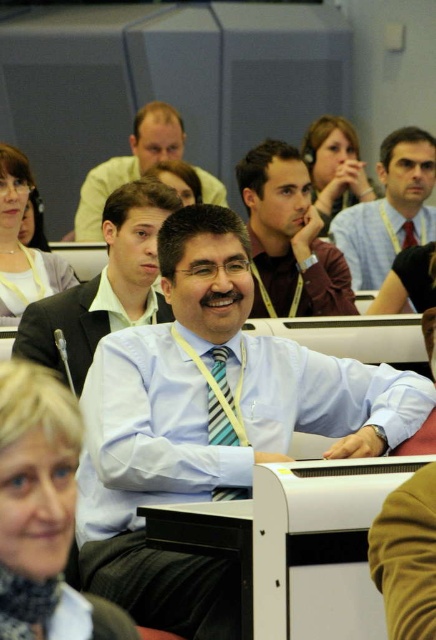
In the conference room scene, there is a man wearing a striped fabric tie at center and a lanyard around his neck. What is located at the point with coordinates (x=222, y=403)?

The point at (x=222, y=403) is on the striped fabric tie at center.

You are standing in the conference room and want to place a small plant exactly at point (320, 240). The plant requires a space of 1 meter in front of it to grow properly. Is there enough space in front of the point 0.376, 0.736 for the plant to grow?

The distance between point (320, 240) and the viewer is 4.63 meters, so there is enough space in front of point (320, 240) for the plant to grow since 4.63 meters is greater than the required 1 meter.